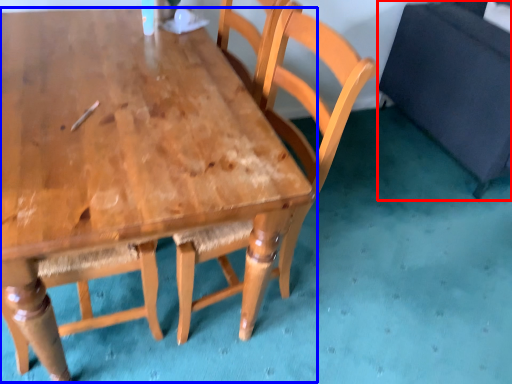
Question: Which point is closer to the camera, swivel chair (highlighted by a red box) or table (highlighted by a blue box)?

Choices:
 (A) swivel chair
 (B) table

Answer: (B)